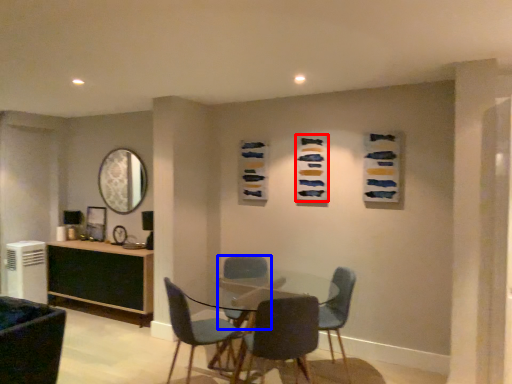
Question: Among these objects, which one is farthest to the camera, art (highlighted by a red box) or chair (highlighted by a blue box)?

Choices:
 (A) art
 (B) chair

Answer: (A)